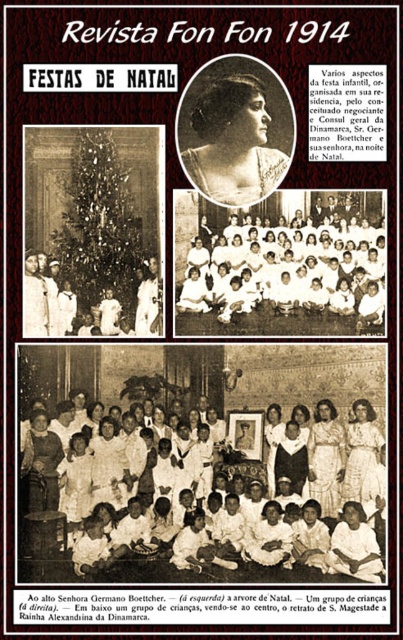
Based on the photo, you are an art conservator examining the vintage poster and notice two points marked on it. The first point is at coordinates point (340,477) and the second is at point (353,412). From your perspective, which point appears closer to you?

Point (340,477) is closer to the camera than point (353,412).